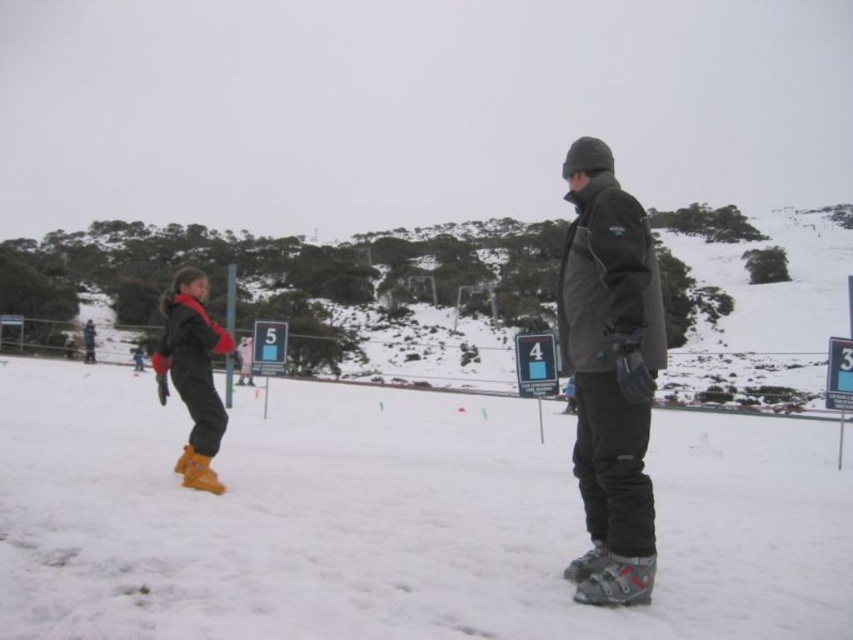
Question: Which object is closer to the camera taking this photo?

Choices:
 (A) matte yellow ski boots at lower left
 (B) snowy ski slope at center
 (C) dark gray matte jacket at center

Answer: (B)

Question: Is snowy ski slope at left smaller than matte yellow ski boots at lower left?

Choices:
 (A) no
 (B) yes

Answer: (A)

Question: Which of the following is the closest to the observer?

Choices:
 (A) dark gray matte jacket at center
 (B) snowy ski slope at center
 (C) matte yellow ski boots at lower left

Answer: (B)

Question: Can you confirm if snowy ski slope at left is wider than matte yellow ski boots at lower left?

Choices:
 (A) no
 (B) yes

Answer: (B)

Question: Which point is farther from the camera taking this photo?

Choices:
 (A) (596, 173)
 (B) (792, 273)
 (C) (664, 593)

Answer: (B)

Question: Where is snowy ski slope at left located in relation to dark gray matte jacket at center in the image?

Choices:
 (A) above
 (B) below

Answer: (A)